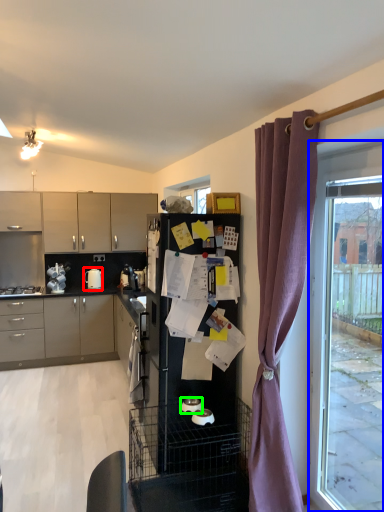
Question: Which object is positioned farthest from kitchen appliance (highlighted by a red box)? Select from window (highlighted by a blue box) and appliance (highlighted by a green box).

Choices:
 (A) window
 (B) appliance

Answer: (A)